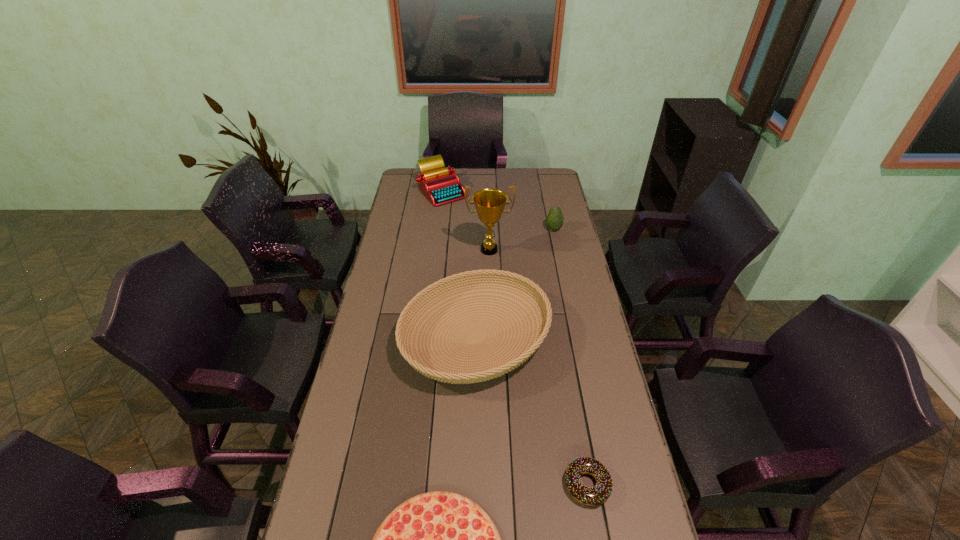
At what (x,y) coordinates should I click in order to perform the action: click on the tallest object. Please return your answer as a coordinate pair (x, y). Looking at the image, I should click on (489, 203).

You are a GUI agent. You are given a task and a screenshot of the screen. Output one action in this format:
    pyautogui.click(x=<x>, y=<y>)
    Task: Click on the award
    
    Given the screenshot: What is the action you would take?
    pyautogui.click(x=489, y=203)

What are the coordinates of `the farthest object` in the screenshot? It's located at (440, 185).

Identify the location of avocado. (554, 221).

I want to click on basket, so click(438, 370).

The height and width of the screenshot is (540, 960). What are the coordinates of `the second shortest object` in the screenshot? It's located at (594, 496).

The image size is (960, 540). What are the coordinates of `free region located 0.190m on the front view with handles of the tallest object` in the screenshot? It's located at (491, 292).

Where is `free location located 0.050m on the typing side of the farthest object`? free location located 0.050m on the typing side of the farthest object is located at coordinates (439, 213).

Image resolution: width=960 pixels, height=540 pixels. I want to click on vacant space located on the left of the avocado, so click(x=458, y=229).

Locate an element on the screen. vacant area situated on the front of the fourth farthest object is located at coordinates pyautogui.click(x=475, y=413).